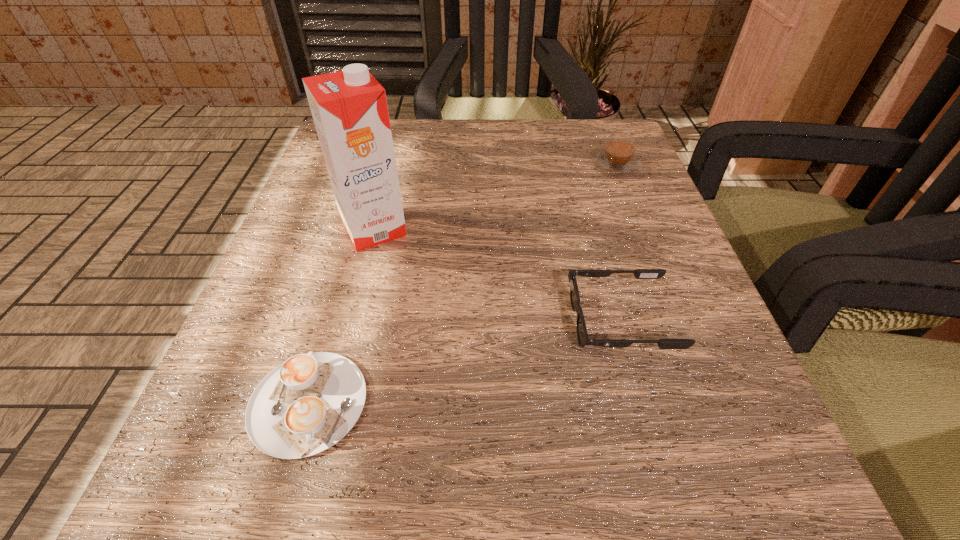
The width and height of the screenshot is (960, 540). I want to click on free location that satisfies the following two spatial constraints: 1. on the temples of the sunglasses; 2. on the front side of the shorter cappuccino, so click(x=644, y=403).

The width and height of the screenshot is (960, 540). Find the location of `free location that satisfies the following two spatial constraints: 1. on the front side of the right cappuccino; 2. on the temples of the third tallest object`. free location that satisfies the following two spatial constraints: 1. on the front side of the right cappuccino; 2. on the temples of the third tallest object is located at coordinates (677, 321).

This screenshot has height=540, width=960. Identify the location of free spot that satisfies the following two spatial constraints: 1. on the front side of the farthest object; 2. on the temples of the sunglasses. (677, 321).